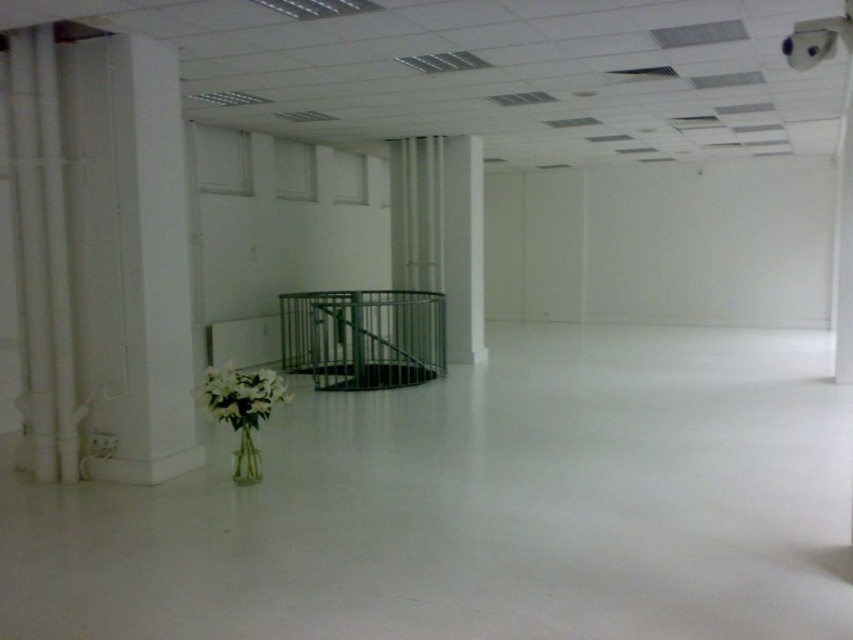
Question: Observing the image, what is the correct spatial positioning of white glossy pillar at center in reference to transparent glass vase at center?

Choices:
 (A) below
 (B) above

Answer: (B)

Question: Which object is the farthest from the white smooth pillar at left?

Choices:
 (A) white glossy pillar at center
 (B) green metal balustrade at center

Answer: (A)

Question: Can you confirm if green metal balustrade at center is smaller than transparent glass vase at center?

Choices:
 (A) yes
 (B) no

Answer: (B)

Question: Which object is positioned closest to the transparent glass vase at center?

Choices:
 (A) green metal balustrade at center
 (B) white matte flowers at lower left
 (C) white glossy pillar at center
 (D) white smooth pillar at left

Answer: (B)

Question: Which object is closer to the camera taking this photo?

Choices:
 (A) white glossy pillar at center
 (B) green metal balustrade at center
 (C) transparent glass vase at center

Answer: (C)

Question: Does white smooth pillar at left appear on the left side of green metal balustrade at center?

Choices:
 (A) no
 (B) yes

Answer: (B)